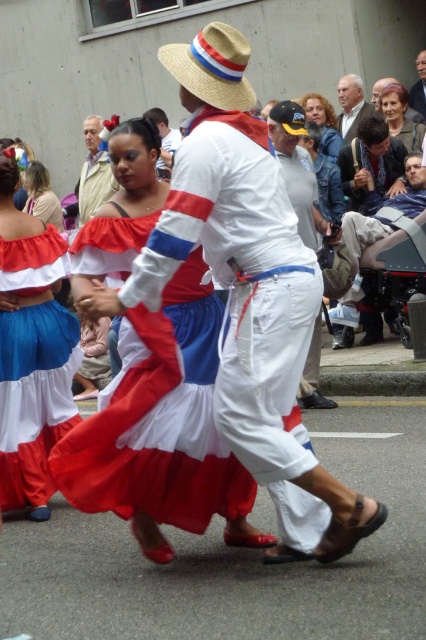
Question: In this image, where is smooth beige hair at upper center located relative to white cotton hat at upper center?

Choices:
 (A) left
 (B) right

Answer: (B)

Question: Among these objects, which one is nearest to the camera?

Choices:
 (A) white cotton pants at center
 (B) matte white blouse at center

Answer: (A)

Question: Is the position of matte white blouse at center more distant than that of smooth gray hair at upper center?

Choices:
 (A) no
 (B) yes

Answer: (B)

Question: Can you confirm if smooth beige hair at upper center is positioned to the right of white cotton shirt at center?

Choices:
 (A) no
 (B) yes

Answer: (A)

Question: Which of these objects is positioned closest to the white cotton hat at upper center?

Choices:
 (A) white cotton pants at center
 (B) matte white blouse at center
 (C) smooth gray hair at upper center

Answer: (B)

Question: Considering the real-world distances, which object is farthest from the white cotton hat at upper center?

Choices:
 (A) white cotton pants at center
 (B) straw hat at upper center
 (C) matte white skirt at center

Answer: (C)